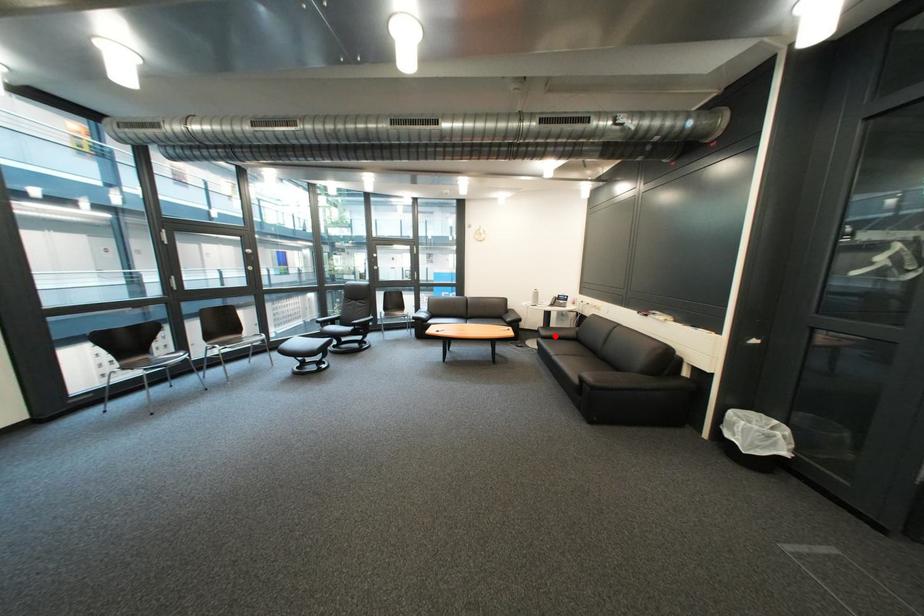
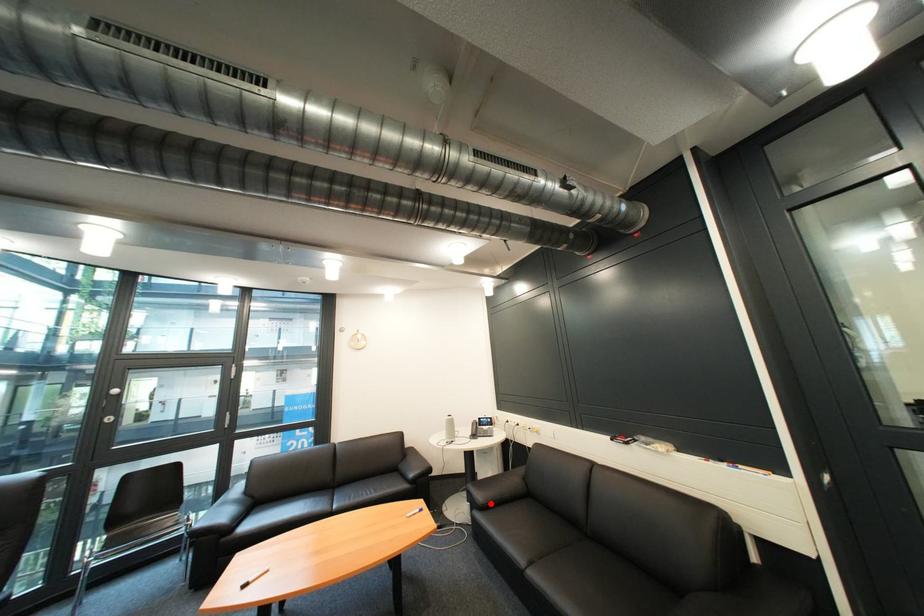
I am providing you with two images of the same scene from different viewpoints. A red point is marked on the first image and another point is marked on the second image. Is the red point in image1 aligned with the point shown in image2?

Yes